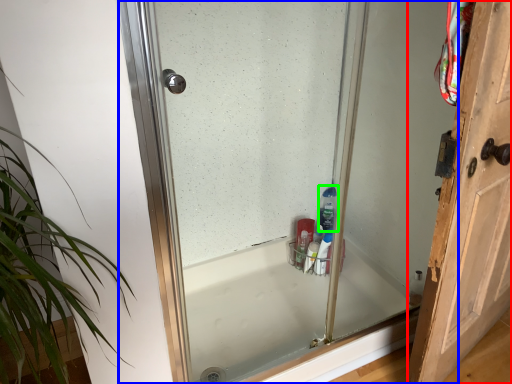
Question: Which is farther away from door (highlighted by a red box)? glass door (highlighted by a blue box) or cleaning product (highlighted by a green box)?

Choices:
 (A) glass door
 (B) cleaning product

Answer: (A)